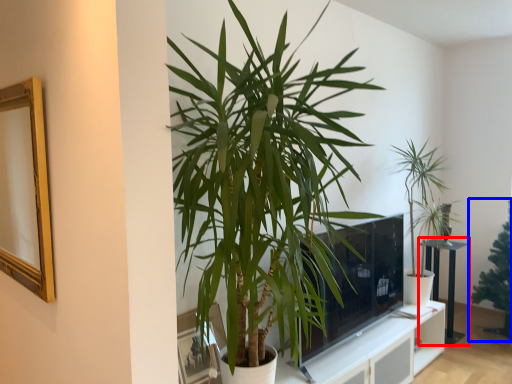
Question: Which of the following is the closest to the observer, table (highlighted by a red box) or houseplant (highlighted by a blue box)?

Choices:
 (A) table
 (B) houseplant

Answer: (B)